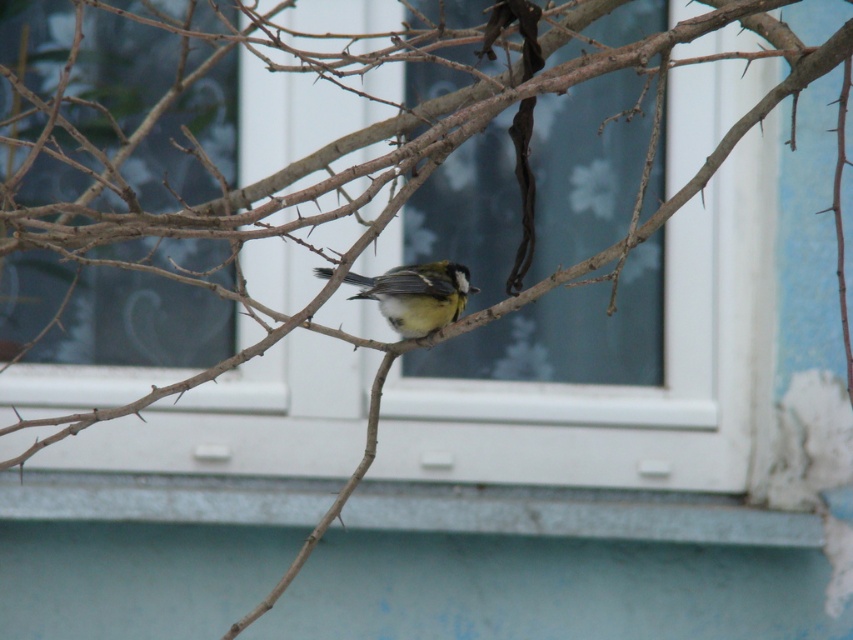
Who is more forward, (346,467) or (648,538)?

Positioned in front is point (648,538).

Between point (280, 188) and point (102, 506), which one is positioned behind?

The point (102, 506) is more distant.

Image resolution: width=853 pixels, height=640 pixels. What are the coordinates of `transparent glass window at center` in the screenshot? It's located at (537, 241).

Does transparent glass window at center have a greater width compared to yellow-green feathers at center?

Yes.

Is transparent glass window at center shorter than yellow-green feathers at center?

Incorrect, transparent glass window at center's height does not fall short of yellow-green feathers at center's.

Who is more distant from viewer, (79, 99) or (462, 269)?

Positioned behind is point (79, 99).

I want to click on transparent glass window at center, so pos(537,241).

Who is shorter, blue painted wood at lower center or yellow-green feathers at center?

yellow-green feathers at center is shorter.

Which is behind, point (212, 486) or point (457, 285)?

The point (212, 486) is more distant.

Who is more distant from viewer, (51, 492) or (436, 280)?

Positioned behind is point (51, 492).

Locate an element on the screen. The width and height of the screenshot is (853, 640). blue painted wood at lower center is located at coordinates (576, 513).